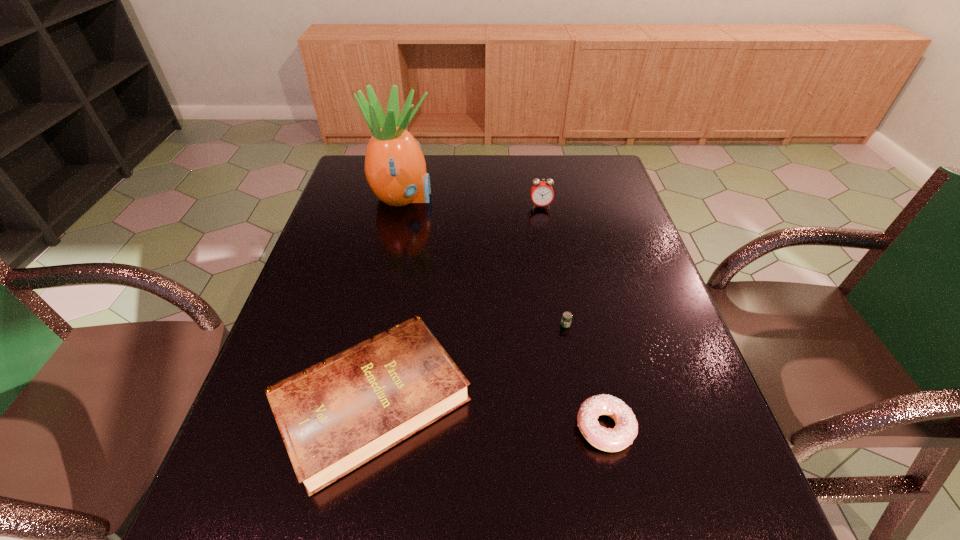
Identify the location of free spot between the fourth shortest object and the third shortest object. The height and width of the screenshot is (540, 960). (456, 303).

Where is `free space between the second tallest object and the shortest object`? The image size is (960, 540). free space between the second tallest object and the shortest object is located at coordinates (553, 265).

Find the location of a particular element. The height and width of the screenshot is (540, 960). empty space between the tallest object and the fourth tallest object is located at coordinates (504, 313).

Image resolution: width=960 pixels, height=540 pixels. I want to click on vacant area between the beer can and the second shortest object, so click(585, 376).

You are a GUI agent. You are given a task and a screenshot of the screen. Output one action in this format:
    pyautogui.click(x=<x>, y=<y>)
    Task: Click on the vacant area between the second tallest object and the tallest object
    The height and width of the screenshot is (540, 960).
    Given the screenshot: What is the action you would take?
    pyautogui.click(x=471, y=202)

Identify the location of free space between the tallest object and the second tallest object. (471, 202).

In order to click on free space between the tallest object and the doughnut in this screenshot , I will do `click(504, 313)`.

Find the location of a particular element. This screenshot has height=540, width=960. unoccupied area between the pineapple and the third tallest object is located at coordinates (387, 300).

In order to click on free space between the beer can and the second tallest object in this screenshot , I will do `click(553, 265)`.

Select which object appears as the fourth closest to the hardback book. Please provide its 2D coordinates. Your answer should be formatted as a tuple, i.e. [(x, y)], where the tuple contains the x and y coordinates of a point satisfying the conditions above.

[(542, 193)]